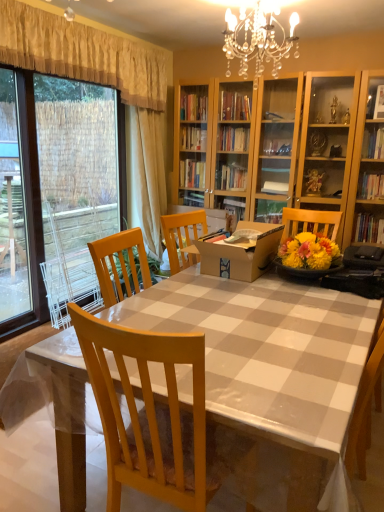
Question: From the image's perspective, is transparent glass door at left on top of yellow textured curtain at upper left, marked as the first curtain in a front-to-back arrangement?

Choices:
 (A) yes
 (B) no

Answer: (B)

Question: Can you confirm if transparent glass door at left is taller than yellow textured curtain at upper left, marked as the second curtain in a back-to-front arrangement?

Choices:
 (A) yes
 (B) no

Answer: (A)

Question: Is transparent glass door at left to the left of yellow textured curtain at upper left, marked as the second curtain in a back-to-front arrangement, from the viewer's perspective?

Choices:
 (A) yes
 (B) no

Answer: (A)

Question: From the image's perspective, is transparent glass door at left located beneath yellow textured curtain at upper left, marked as the second curtain in a back-to-front arrangement?

Choices:
 (A) yes
 (B) no

Answer: (A)

Question: Would you say transparent glass door at left is a long distance from yellow textured curtain at upper left, marked as the second curtain in a back-to-front arrangement?

Choices:
 (A) yes
 (B) no

Answer: (B)

Question: Looking at the image, does transparent glass door at left seem bigger or smaller compared to beige fabric curtain at upper left, which ranks as the 2th curtain in front-to-back order?

Choices:
 (A) small
 (B) big

Answer: (B)

Question: From the image's perspective, is transparent glass door at left located above or below beige fabric curtain at upper left, which appears as the 1th curtain when viewed from the back?

Choices:
 (A) below
 (B) above

Answer: (A)

Question: Relative to beige fabric curtain at upper left, which appears as the 1th curtain when viewed from the back, is transparent glass door at left in front or behind?

Choices:
 (A) behind
 (B) front

Answer: (B)

Question: From a real-world perspective, is transparent glass door at left above or below beige fabric curtain at upper left, which appears as the 1th curtain when viewed from the back?

Choices:
 (A) above
 (B) below

Answer: (B)

Question: Is transparent glass door at left taller or shorter than yellow textured curtain at upper left, marked as the first curtain in a front-to-back arrangement?

Choices:
 (A) short
 (B) tall

Answer: (B)

Question: Considering the positions of point (71, 139) and point (117, 40), is point (71, 139) closer or farther from the camera than point (117, 40)?

Choices:
 (A) farther
 (B) closer

Answer: (A)

Question: From a real-world perspective, is transparent glass door at left positioned above or below yellow textured curtain at upper left, marked as the first curtain in a front-to-back arrangement?

Choices:
 (A) below
 (B) above

Answer: (A)

Question: Considering the positions of transparent glass door at left and yellow textured curtain at upper left, marked as the first curtain in a front-to-back arrangement, in the image, is transparent glass door at left bigger or smaller than yellow textured curtain at upper left, marked as the first curtain in a front-to-back arrangement,?

Choices:
 (A) big
 (B) small

Answer: (A)

Question: Considering their positions, is white glossy table at center located in front of or behind transparent glass door at left?

Choices:
 (A) front
 (B) behind

Answer: (A)

Question: Considering the positions of white glossy table at center and transparent glass door at left in the image, is white glossy table at center taller or shorter than transparent glass door at left?

Choices:
 (A) short
 (B) tall

Answer: (A)